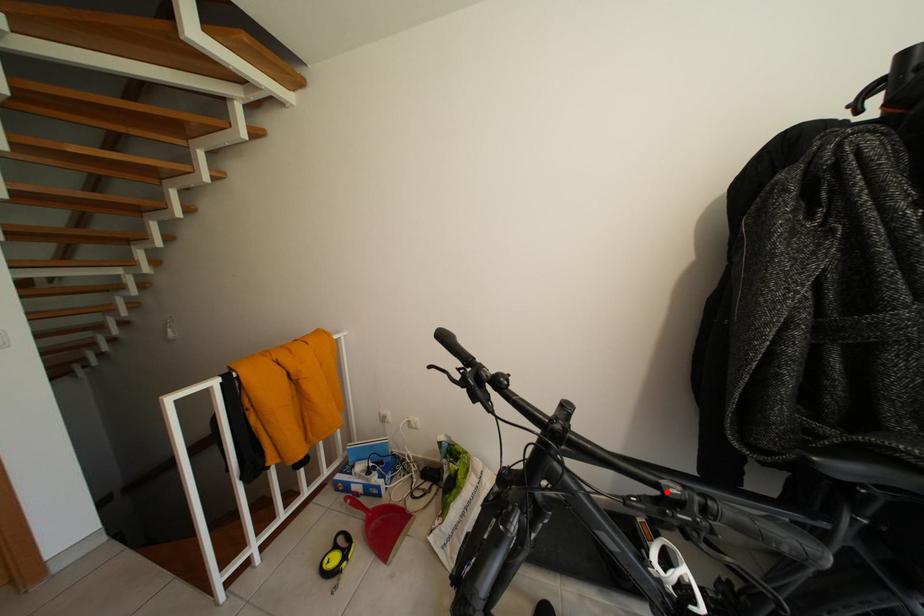
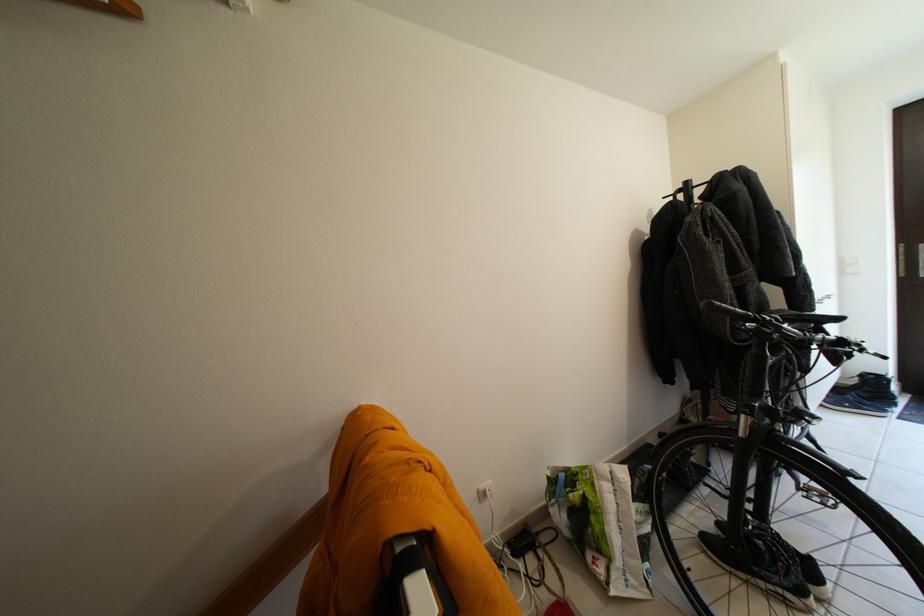
Find the pixel in the second image that matches the highlighted location in the first image.

(849, 344)